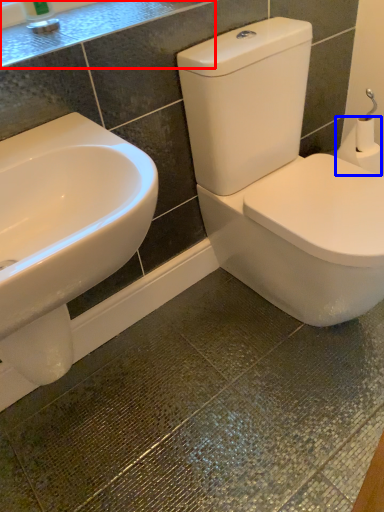
Question: Which of the following is the closest to the observer, counter top (highlighted by a red box) or toilet paper (highlighted by a blue box)?

Choices:
 (A) counter top
 (B) toilet paper

Answer: (A)